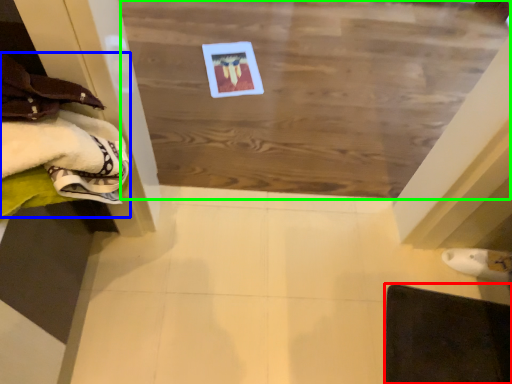
Question: Which is nearer to the furniture (highlighted by a red box)? clothing (highlighted by a blue box) or plywood (highlighted by a green box).

Choices:
 (A) clothing
 (B) plywood

Answer: (B)